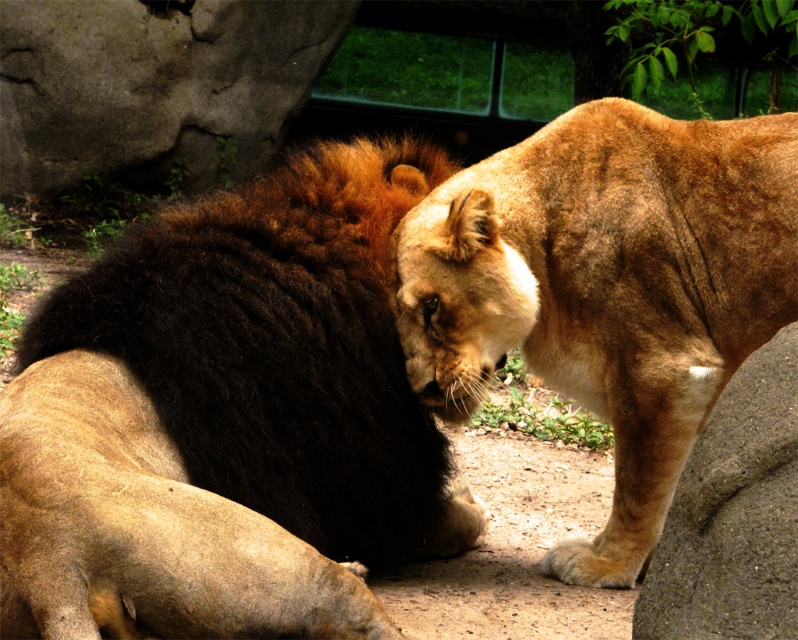
You are a zookeeper observing the lions in their enclosure. You notice the dark brown fur lion at center and the golden fur lion at center. Which lion is closer to you based on their positions?

The dark brown fur lion at center is closer to you because it is positioned in front of the golden fur lion at center.

You are a zookeeper observing the lions in their enclosure. You notice the dark brown fur lion at center and the golden fur lion at center. Which lion is shorter in height?

The dark brown fur lion at center is not as tall as the golden fur lion at center, so the dark brown fur lion at center is shorter in height.

You are a zookeeper observing two lions in their enclosure. You notice the dark brown fur lion at center and the golden fur lion at center. Which lion do you think is larger in size?

The dark brown fur lion at center is bigger than the golden fur lion at center, so the dark brown fur lion at center is larger in size.